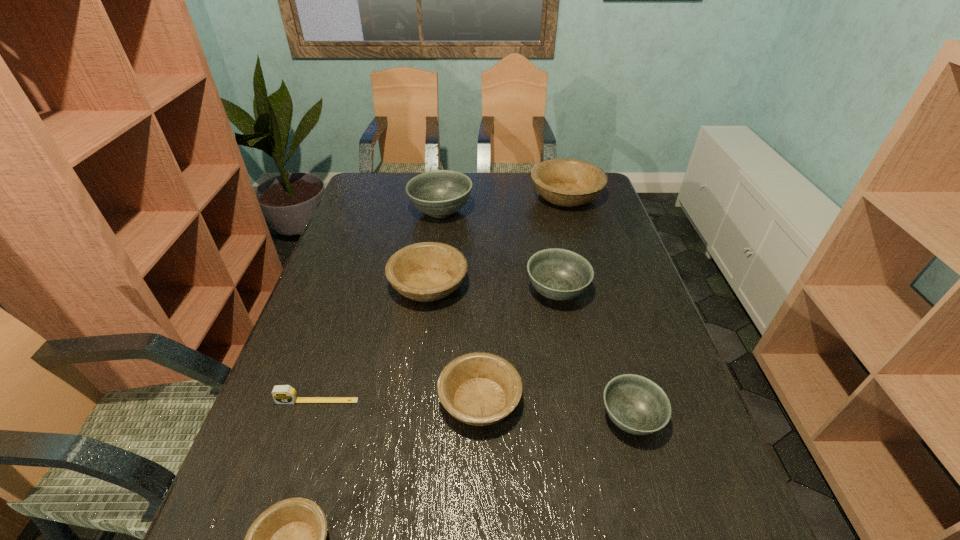
At what (x,y) coordinates should I click in order to perform the action: click on the biggest gray bowl. Please return your answer as a coordinate pair (x, y). Image resolution: width=960 pixels, height=540 pixels. Looking at the image, I should click on (440, 193).

This screenshot has height=540, width=960. In order to click on the tallest object in this screenshot , I will do `click(440, 193)`.

Locate an element on the screen. the farthest beige bowl is located at coordinates (564, 182).

Where is `the biggest beige bowl`? The height and width of the screenshot is (540, 960). the biggest beige bowl is located at coordinates (564, 182).

Find the location of a particular element. the second nearest gray bowl is located at coordinates (559, 274).

This screenshot has height=540, width=960. Find the location of `the third smallest beige bowl`. the third smallest beige bowl is located at coordinates (428, 271).

Find the location of a particular element. This screenshot has width=960, height=540. the nearest gray bowl is located at coordinates (637, 405).

What are the coordinates of `the third biggest beige bowl` in the screenshot? It's located at pos(479,388).

Image resolution: width=960 pixels, height=540 pixels. Identify the location of tape measure. (282, 394).

Locate an element on the screen. free location located 0.190m on the front of the tallest object is located at coordinates pyautogui.click(x=434, y=266).